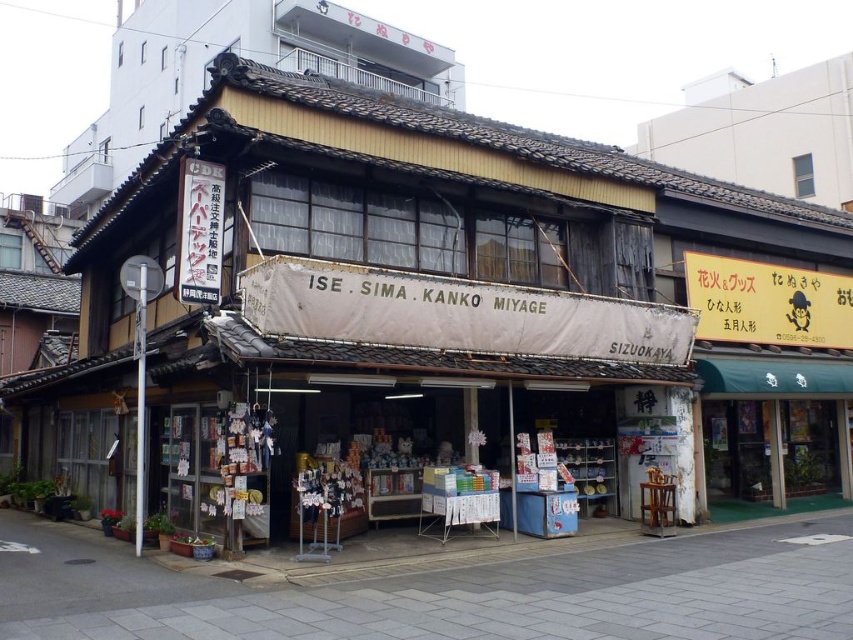
Question: In this image, where is yellow paper sign at upper right located relative to black paper sign at upper left?

Choices:
 (A) below
 (B) above

Answer: (A)

Question: Which of the following is the closest to the observer?

Choices:
 (A) yellow paper sign at upper right
 (B) black paper sign at upper left

Answer: (B)

Question: Observing the image, what is the correct spatial positioning of yellow paper sign at upper right in reference to black paper sign at upper left?

Choices:
 (A) below
 (B) above

Answer: (A)

Question: Is yellow paper sign at upper right in front of black paper sign at upper left?

Choices:
 (A) yes
 (B) no

Answer: (B)